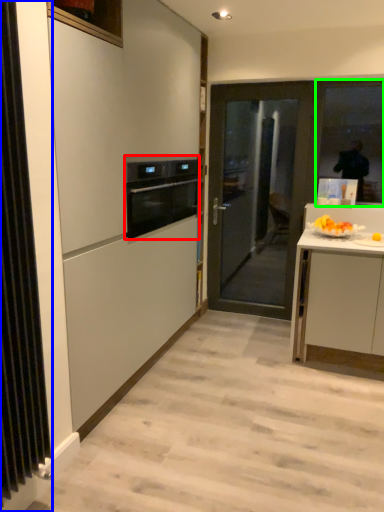
Question: Which is farther away from kitchen appliance (highlighted by a red box)? radiator (highlighted by a blue box) or window (highlighted by a green box)?

Choices:
 (A) radiator
 (B) window

Answer: (B)